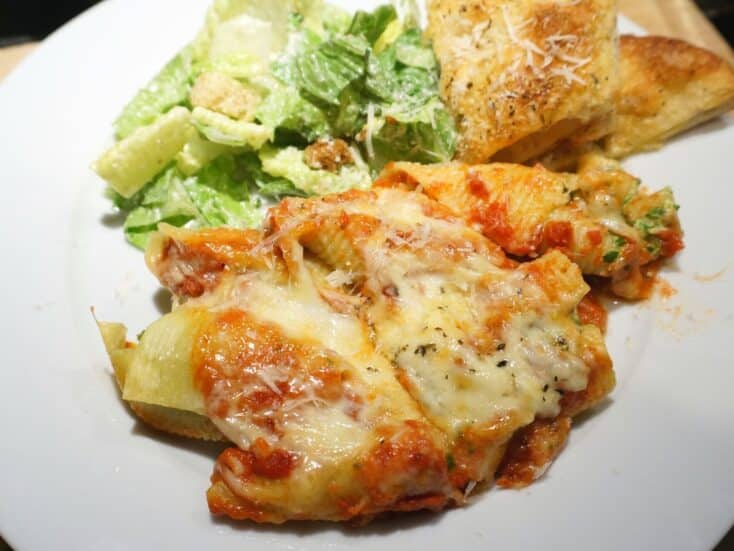
Identify the location of light brown area right on table. The height and width of the screenshot is (551, 734). (655, 20).